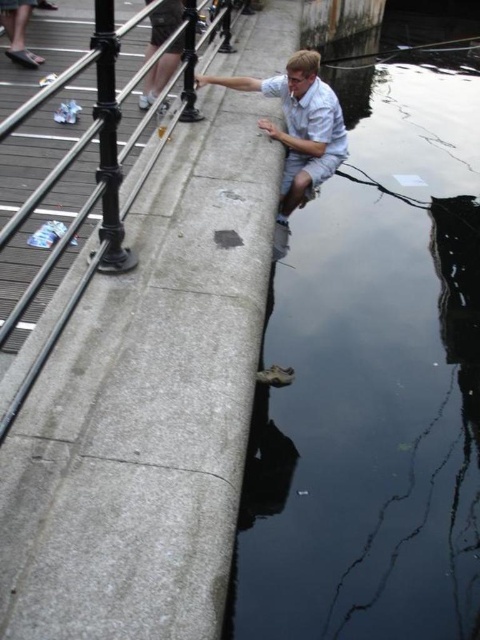
Question: Which object appears farthest from the camera in this image?

Choices:
 (A) transparent glass water at lower right
 (B) white cotton shirt at center

Answer: (B)

Question: Is transparent glass water at lower right smaller than polished metal rail at upper center?

Choices:
 (A) no
 (B) yes

Answer: (A)

Question: Which point appears closest to the camera in this image?

Choices:
 (A) (168, 138)
 (B) (394, 128)

Answer: (A)

Question: Considering the real-world distances, which object is closest to the transparent glass water at lower right?

Choices:
 (A) white cotton shirt at center
 (B) polished metal rail at upper center

Answer: (A)

Question: From the image, what is the correct spatial relationship of transparent glass water at lower right in relation to polished metal rail at upper center?

Choices:
 (A) left
 (B) right

Answer: (B)

Question: Is the position of white cotton shirt at center less distant than that of polished metal rail at upper center?

Choices:
 (A) no
 (B) yes

Answer: (A)